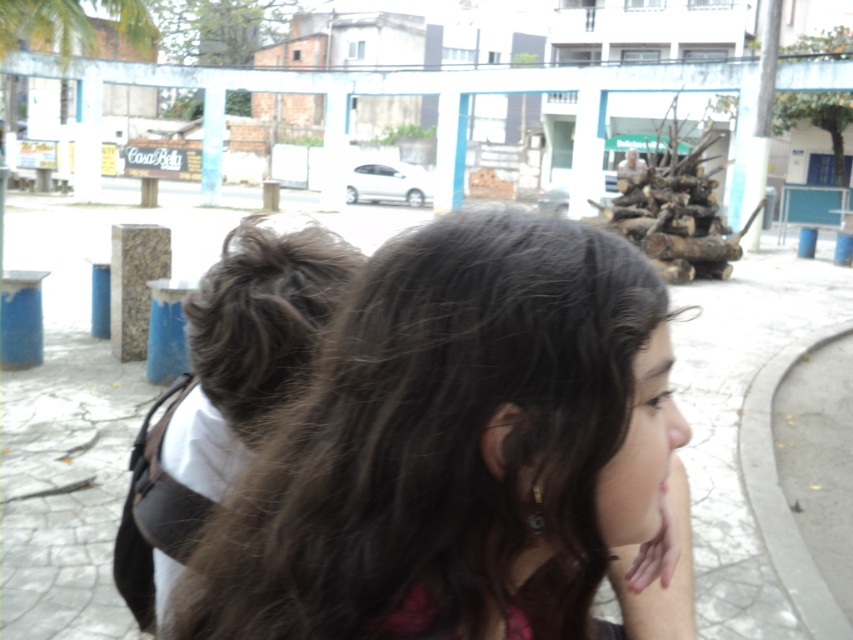
Question: Does dark brown hair at center have a larger size compared to green leafy palm tree at upper left?

Choices:
 (A) no
 (B) yes

Answer: (A)

Question: Which point is closer to the camera?

Choices:
 (A) (433, 628)
 (B) (73, 49)

Answer: (A)

Question: Among these points, which one is farthest from the camera?

Choices:
 (A) [67, 0]
 (B) [468, 609]

Answer: (A)

Question: Is dark brown hair at center below green leafy palm tree at upper left?

Choices:
 (A) yes
 (B) no

Answer: (A)

Question: Is dark brown hair at center positioned in front of green leafy palm tree at upper left?

Choices:
 (A) yes
 (B) no

Answer: (A)